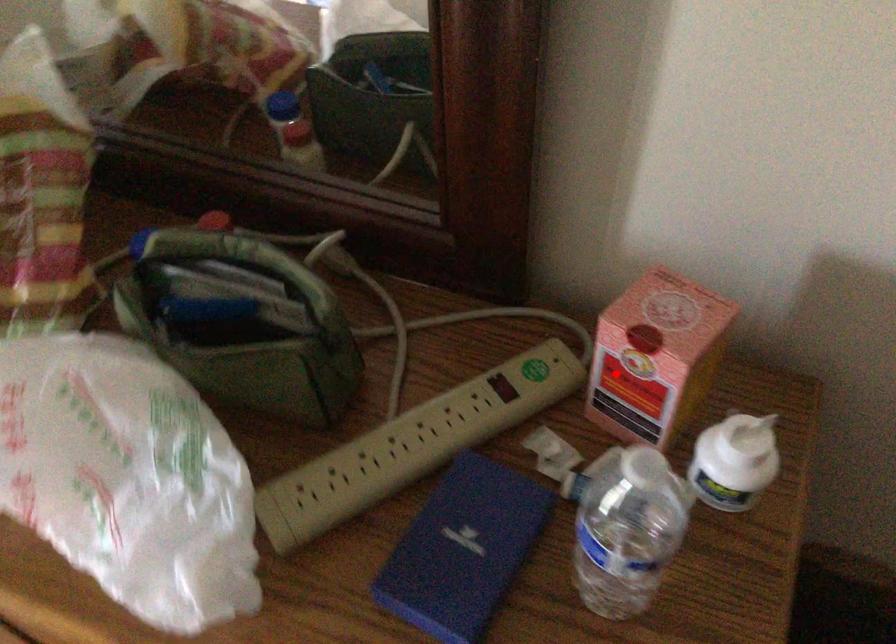
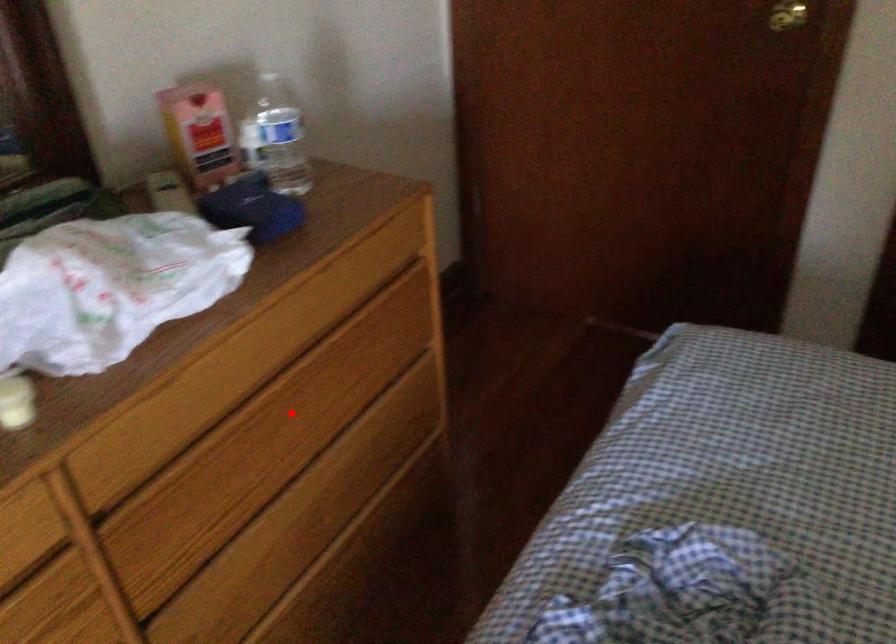
I am providing you with two images of the same scene from different viewpoints. A red point is marked on the first image and another point is marked on the second image. Is the marked point in image1 the same physical position as the marked point in image2?

No